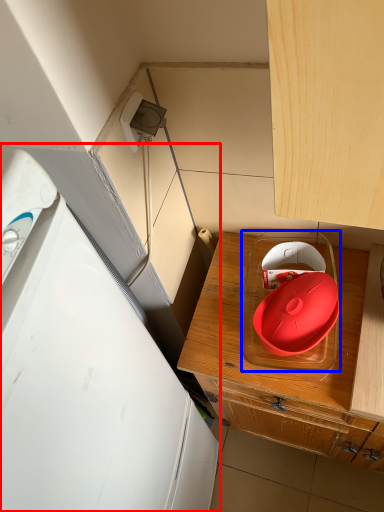
Question: Which of the following is the farthest to the observer, home appliance (highlighted by a red box) or appliance (highlighted by a blue box)?

Choices:
 (A) home appliance
 (B) appliance

Answer: (B)